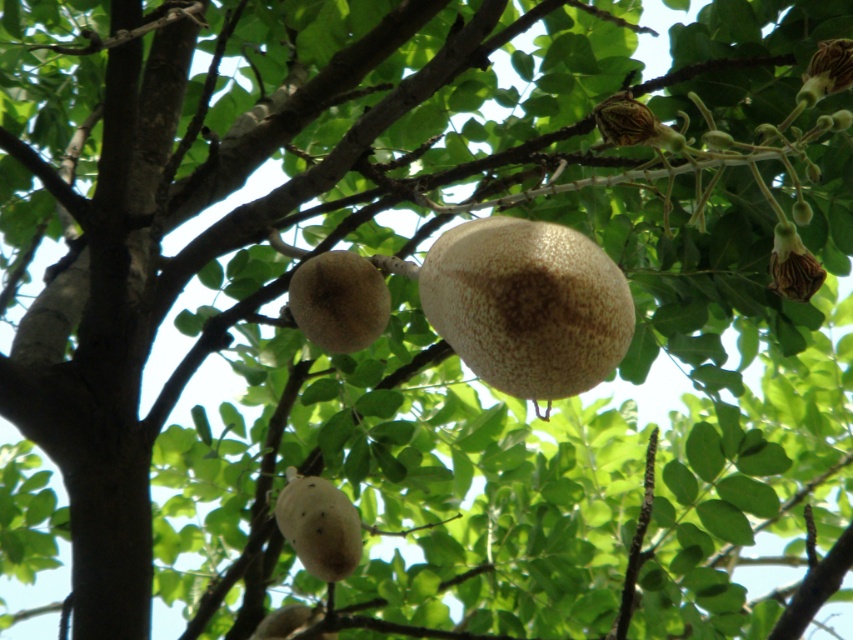
Question: Which point is closer to the camera?

Choices:
 (A) (786, 291)
 (B) (308, 561)

Answer: (A)

Question: Considering the relative positions of speckled brown fruit at center and speckled beige fruit at center in the image provided, where is speckled brown fruit at center located with respect to speckled beige fruit at center?

Choices:
 (A) below
 (B) above

Answer: (B)

Question: Among these points, which one is nearest to the camera?

Choices:
 (A) (556, 340)
 (B) (795, 262)
 (C) (335, 340)
 (D) (317, 492)

Answer: (A)

Question: Estimate the real-world distances between objects in this image. Which object is closer to the speckled brown fruit at lower center?

Choices:
 (A) speckled brown fruit at center
 (B) brown textured flower at upper right

Answer: (B)

Question: Is speckled beige fruit at center smaller than brown textured flower at upper right?

Choices:
 (A) no
 (B) yes

Answer: (A)

Question: In this image, where is speckled beige fruit at center located relative to brown textured flower at upper right?

Choices:
 (A) above
 (B) below

Answer: (B)